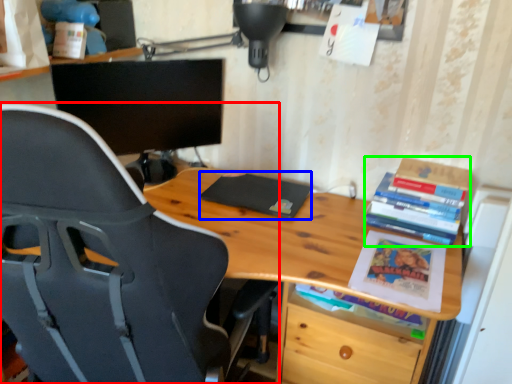
Question: Which is farther away from chair (highlighted by a red box)? paperback book (highlighted by a blue box) or book (highlighted by a green box)?

Choices:
 (A) paperback book
 (B) book

Answer: (B)